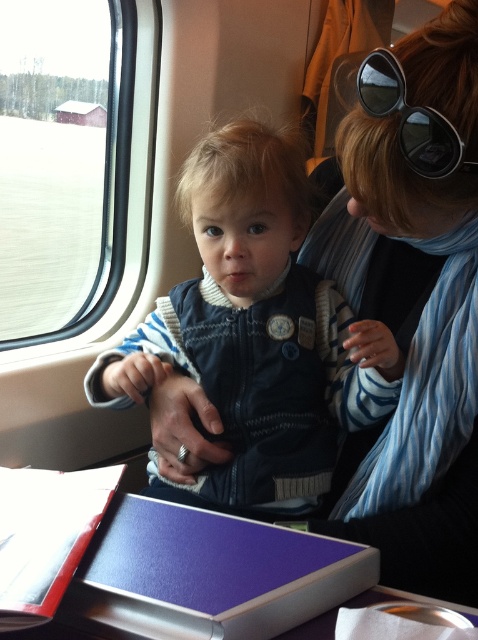
Is transparent glass window at upper left to the right of black reflective sunglasses at upper right from the viewer's perspective?

In fact, transparent glass window at upper left is to the left of black reflective sunglasses at upper right.

Which is below, transparent glass window at upper left or black reflective sunglasses at upper right?

Positioned lower is black reflective sunglasses at upper right.

Does point (100, 19) come behind point (417, 140)?

Yes, point (100, 19) is behind point (417, 140).

The width and height of the screenshot is (478, 640). I want to click on transparent glass window at upper left, so click(63, 163).

Is matte blue vest at center above transparent glass window at upper left?

No.

Can you confirm if matte blue vest at center is smaller than transparent glass window at upper left?

Yes.

What are the coordinates of `matte blue vest at center` in the screenshot? It's located at pyautogui.click(x=256, y=330).

At what (x,y) coordinates should I click in order to perform the action: click on matte blue vest at center. Please return your answer as a coordinate pair (x, y). This screenshot has width=478, height=640. Looking at the image, I should click on (256, 330).

Consider the image. Does matte blue vest at center appear on the left side of black reflective sunglasses at upper right?

Yes, matte blue vest at center is to the left of black reflective sunglasses at upper right.

Does matte blue vest at center appear over black reflective sunglasses at upper right?

Actually, matte blue vest at center is below black reflective sunglasses at upper right.

Is point (305, 442) positioned behind point (445, 124)?

Yes, it is behind point (445, 124).

At what (x,y) coordinates should I click in order to perform the action: click on matte blue vest at center. Please return your answer as a coordinate pair (x, y). Looking at the image, I should click on (256, 330).